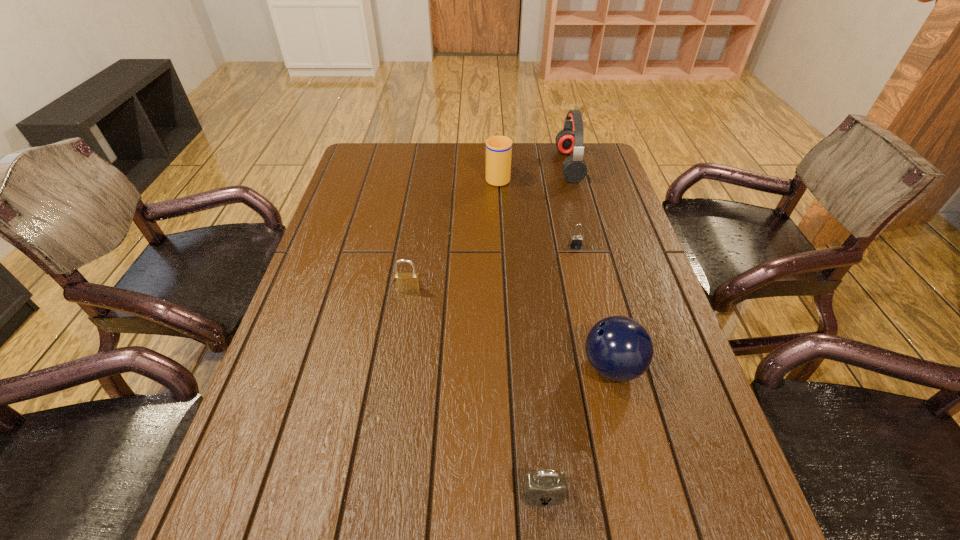
The width and height of the screenshot is (960, 540). I want to click on blank space located on the ear cups of the earphone, so (x=490, y=165).

Image resolution: width=960 pixels, height=540 pixels. What are the coordinates of `vacant region located on the ear cups of the earphone` in the screenshot? It's located at (510, 165).

Locate an element on the screen. free location located on the side of the cup with the handle is located at coordinates (496, 156).

The width and height of the screenshot is (960, 540). I want to click on vacant space located 0.100m on the side of the cup with the handle, so click(496, 153).

Image resolution: width=960 pixels, height=540 pixels. I want to click on free region located on the side of the cup with the handle, so click(x=496, y=153).

Locate an element on the screen. The height and width of the screenshot is (540, 960). vacant space located 0.340m on the surface of the bowling ball near the finger holes is located at coordinates (425, 367).

Where is `vacant space located 0.290m on the surface of the bowling ball near the finger holes`? Image resolution: width=960 pixels, height=540 pixels. vacant space located 0.290m on the surface of the bowling ball near the finger holes is located at coordinates (448, 367).

You are a GUI agent. You are given a task and a screenshot of the screen. Output one action in this format:
    pyautogui.click(x=<x>, y=<y>)
    Task: Click on the vacant space located on the surface of the bowling ball near the finger holes
    Image resolution: width=960 pixels, height=540 pixels.
    Given the screenshot: What is the action you would take?
    pyautogui.click(x=513, y=367)

At what (x,y) coordinates should I click in order to perform the action: click on vacant space positioned on the front-facing side of the second farthest padlock. Please return your answer as a coordinate pair (x, y). This screenshot has width=960, height=540. Looking at the image, I should click on (x=390, y=408).

Image resolution: width=960 pixels, height=540 pixels. Identify the location of vacant region located on the shackle of the shortest padlock. (603, 367).